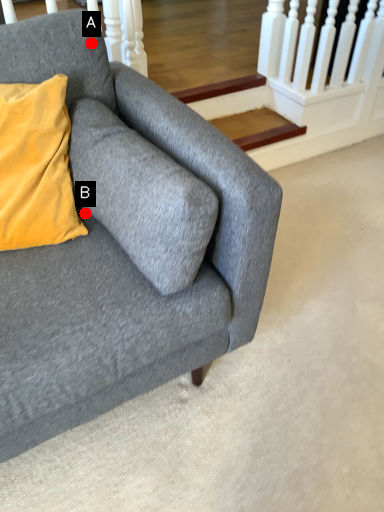
Question: Two points are circled on the image, labeled by A and B beside each circle. Which point is further to the camera?

Choices:
 (A) A is further
 (B) B is further

Answer: (A)